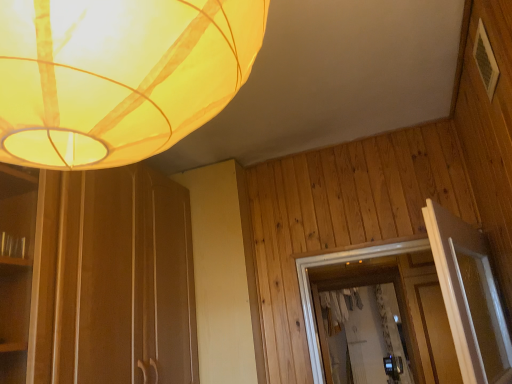
Question: Looking at their shapes, would you say white textured frame at upper right is wider or thinner than translucent yellow fabric lampshade at upper left?

Choices:
 (A) wide
 (B) thin

Answer: (B)

Question: From a real-world perspective, is white textured frame at upper right above or below translucent yellow fabric lampshade at upper left?

Choices:
 (A) below
 (B) above

Answer: (B)

Question: From the image's perspective, is white textured frame at upper right positioned above or below translucent yellow fabric lampshade at upper left?

Choices:
 (A) below
 (B) above

Answer: (B)

Question: In terms of width, does translucent yellow fabric lampshade at upper left look wider or thinner when compared to white textured frame at upper right?

Choices:
 (A) wide
 (B) thin

Answer: (A)

Question: From the image's perspective, is translucent yellow fabric lampshade at upper left above or below white textured frame at upper right?

Choices:
 (A) below
 (B) above

Answer: (A)

Question: In the image, is translucent yellow fabric lampshade at upper left on the left side or the right side of white textured frame at upper right?

Choices:
 (A) left
 (B) right

Answer: (A)

Question: Relative to white textured frame at upper right, is translucent yellow fabric lampshade at upper left in front or behind?

Choices:
 (A) behind
 (B) front

Answer: (B)